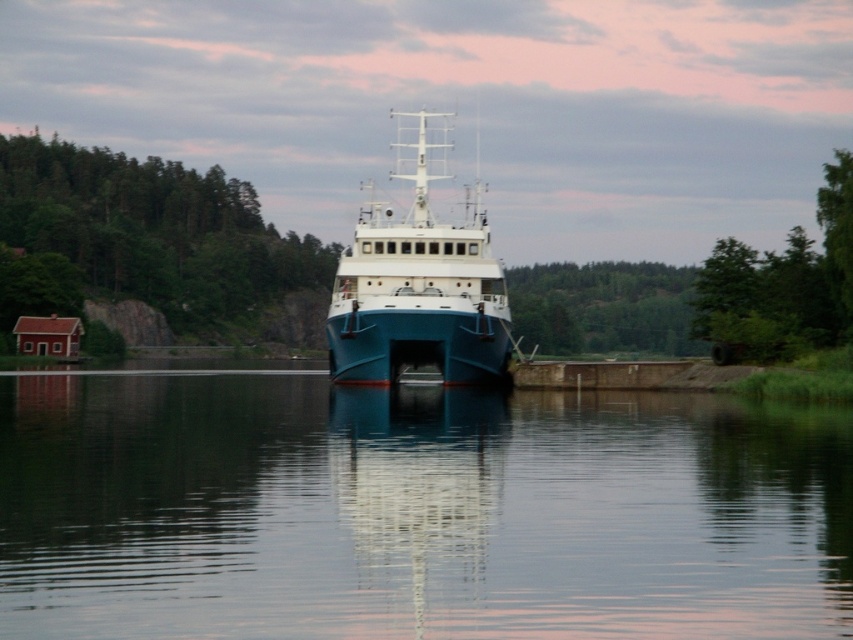
In the scene shown: Is smooth water at center behind blue matte boat at center?

That is False.

Find the location of a particular element. Image resolution: width=853 pixels, height=640 pixels. smooth water at center is located at coordinates (413, 509).